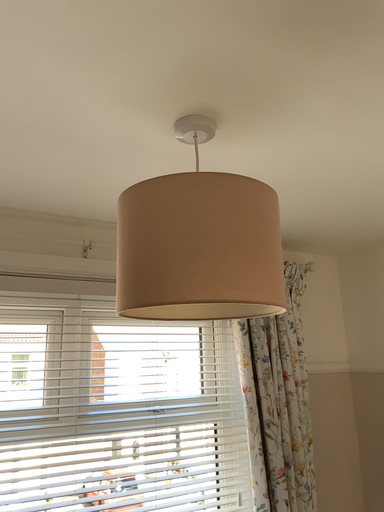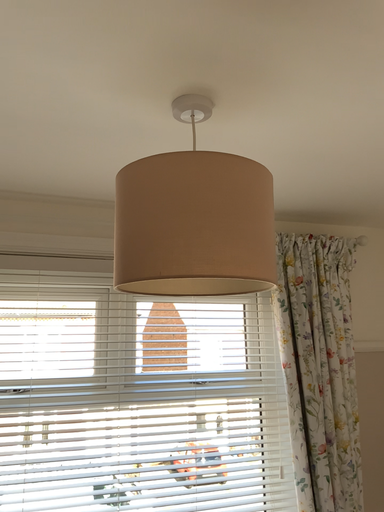
Question: Which way did the camera rotate in the video?

Choices:
 (A) rotated left
 (B) rotated right

Answer: (A)